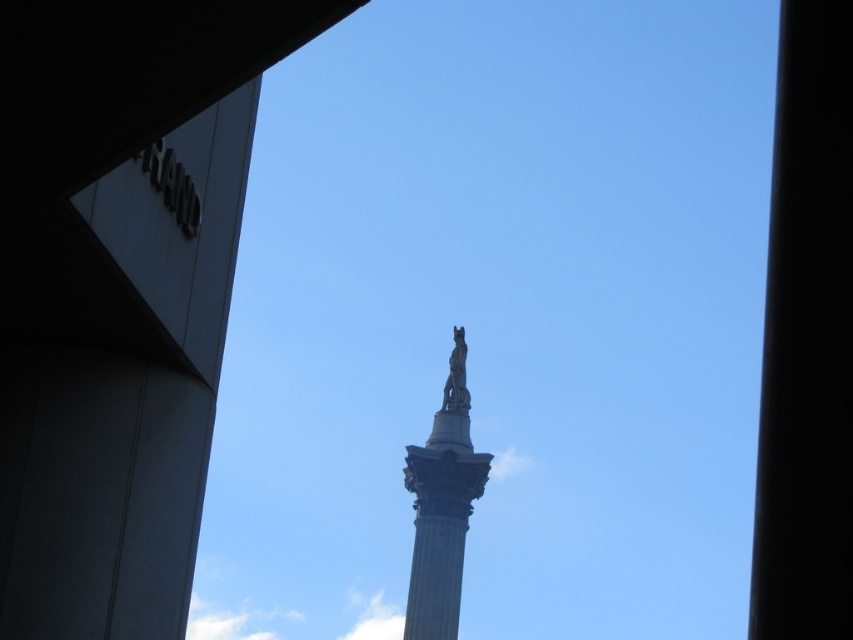
You are an architect planning to install a new light pole between the black marble column at center and the polished bronze statue at center. The light pole requires a minimum of 300 feet of space between the two objects to be installed safely. Can the light pole be placed there?

The black marble column at center and polished bronze statue at center are 332.04 feet apart, which is more than the required 300 feet. Therefore, the light pole can be safely installed between them.

You are standing in front of the monument and notice two columns. The polished stone column at upper center and the black marble column at center. Which column is positioned higher in the image?

The polished stone column at upper center is positioned higher than the black marble column at center.

You are standing in front of the monument and notice two columns at the center. Which column is closer to you, the black marble column at center or the polished stone column at center?

The black marble column at center is closer to you because it is in front of the polished stone column at center.